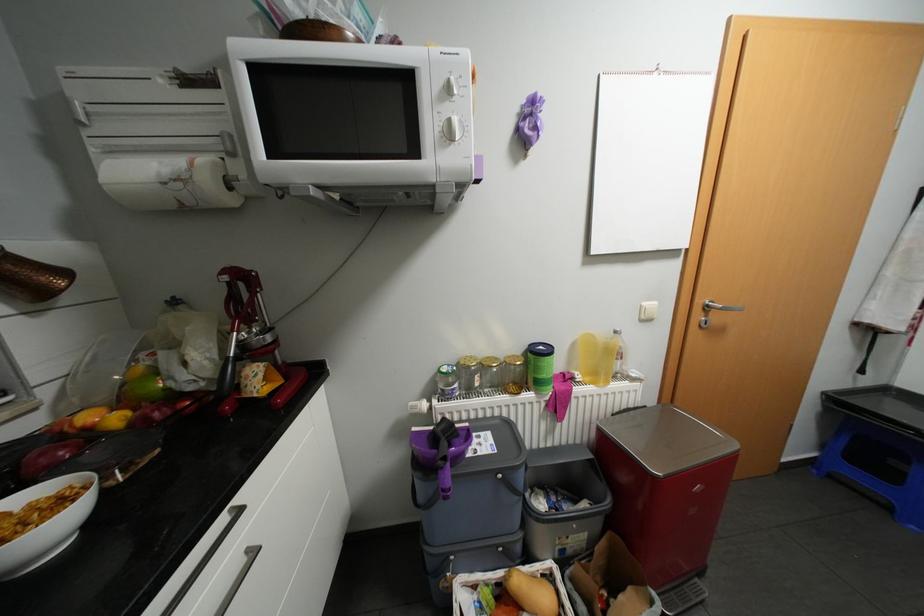
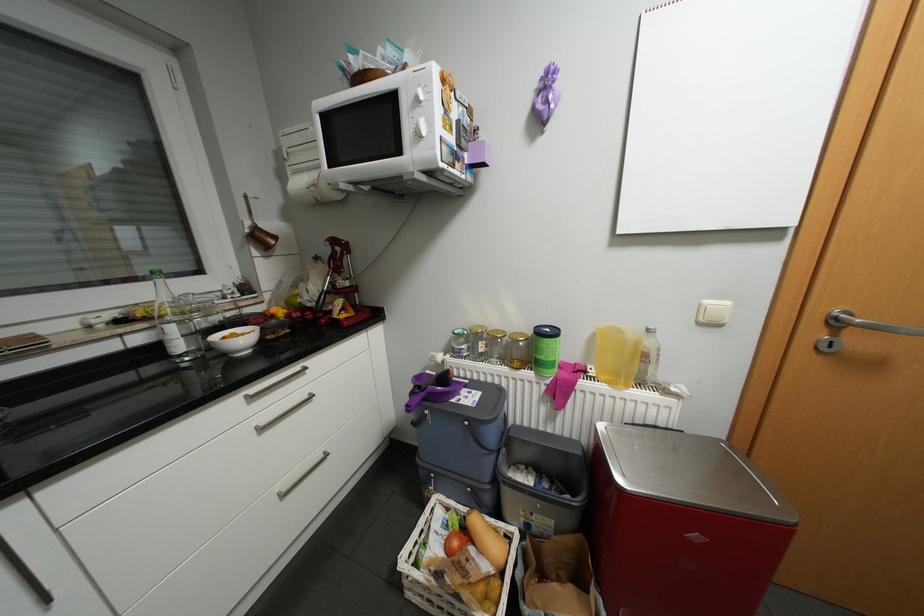
Find the pixel in the second image that matches point (558, 430) in the first image.

(558, 416)